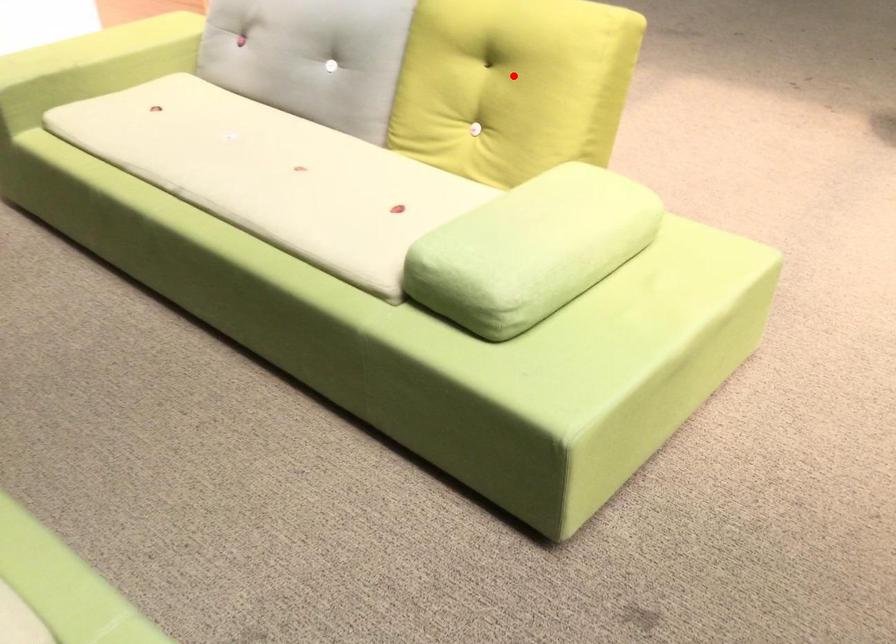
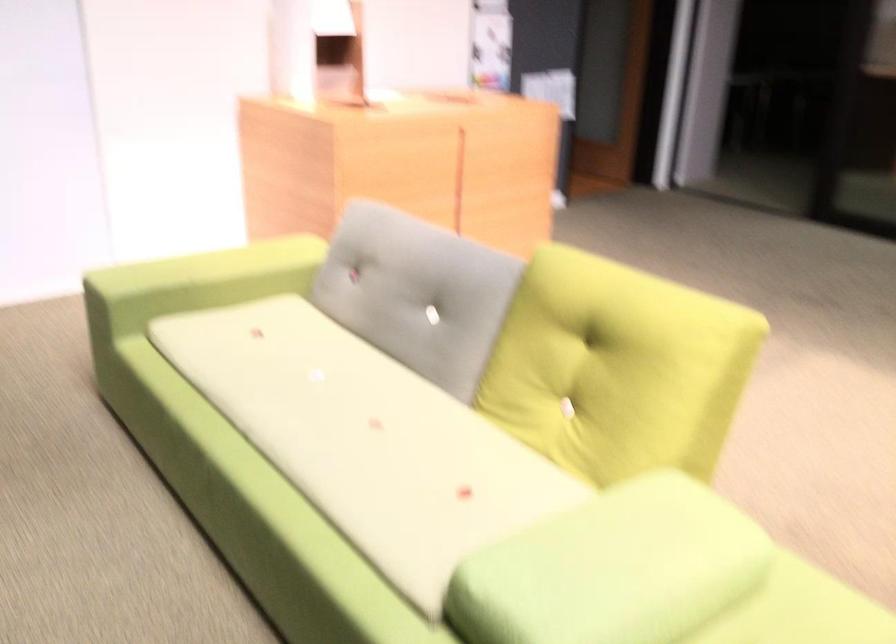
In the second image, find the point that corresponds to the highlighted location in the first image.

(616, 368)